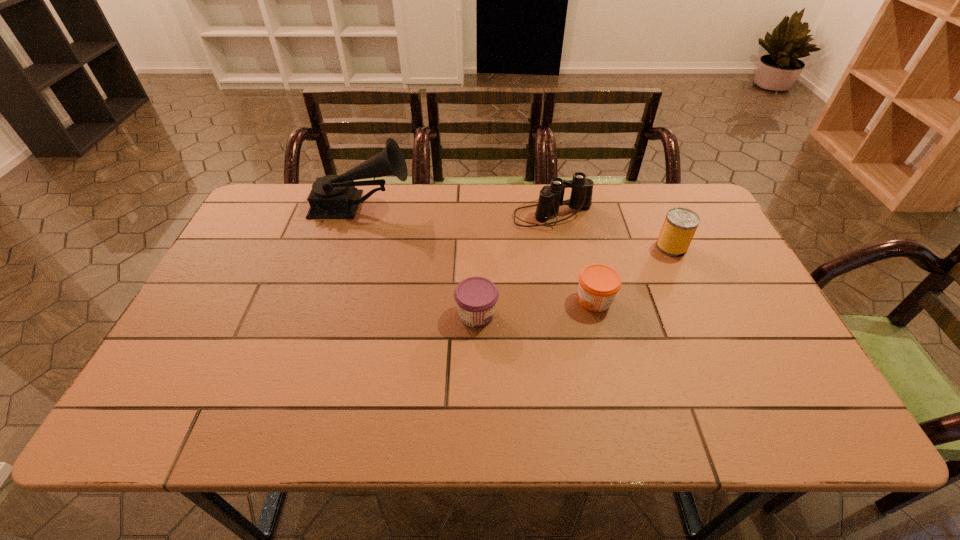
Locate an element on the screen. vacant region located on the front label of the second object from left to right is located at coordinates (x=652, y=314).

This screenshot has width=960, height=540. In order to click on free space located 0.050m on the front label of the right jam in this screenshot , I will do `click(555, 300)`.

You are a GUI agent. You are given a task and a screenshot of the screen. Output one action in this format:
    pyautogui.click(x=<x>, y=<y>)
    Task: Click on the vacant position located 0.080m on the front label of the right jam
    
    Given the screenshot: What is the action you would take?
    pyautogui.click(x=543, y=300)

The height and width of the screenshot is (540, 960). Find the location of `vacant space located 0.380m on the front label of the right jam`. vacant space located 0.380m on the front label of the right jam is located at coordinates (428, 300).

The width and height of the screenshot is (960, 540). I want to click on phonograph_record situated at the far edge, so click(x=333, y=196).

Identify the location of binoculars located in the far edge section of the desktop. This screenshot has width=960, height=540. (551, 197).

Locate an element on the screen. object that is at the right edge is located at coordinates (679, 227).

You are a GUI agent. You are given a task and a screenshot of the screen. Output one action in this format:
    pyautogui.click(x=<x>, y=<y>)
    Task: Click on the vacant space at the far edge of the desktop
    This screenshot has height=540, width=960.
    Given the screenshot: What is the action you would take?
    pyautogui.click(x=480, y=210)

This screenshot has width=960, height=540. What are the coordinates of `free space at the near edge of the desktop` in the screenshot? It's located at (607, 415).

Locate an element on the screen. vacant space at the left edge is located at coordinates (282, 253).